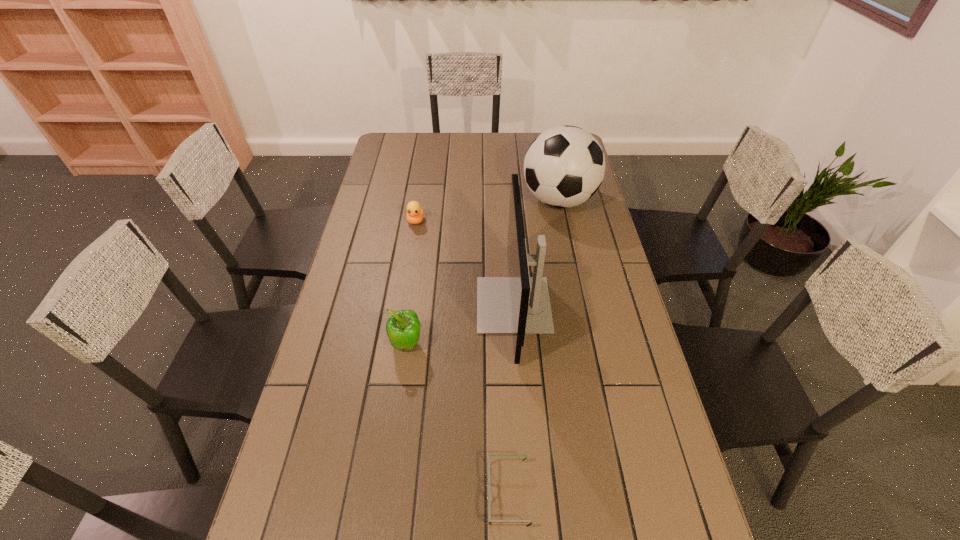
Find the location of a particular element. Image resolution: width=960 pixels, height=540 pixels. object that is the second closest to the nearest object is located at coordinates (403, 329).

Identify the location of vacant space that satisfies the following two spatial constraints: 1. on the screen of the computer monitor; 2. on the front side of the third tallest object. (516, 345).

Find the location of a particular element. vacant space that satisfies the following two spatial constraints: 1. on the face of the bell pepper; 2. on the right side of the fourth tallest object is located at coordinates (396, 345).

This screenshot has height=540, width=960. I want to click on free space that satisfies the following two spatial constraints: 1. on the face of the second shortest object; 2. on the left side of the bell pepper, so click(x=396, y=345).

You are a GUI agent. You are given a task and a screenshot of the screen. Output one action in this format:
    pyautogui.click(x=<x>, y=<y>)
    Task: Click on the free space that satisfies the following two spatial constraints: 1. on the face of the third shortest object; 2. on the left side of the duckling
    
    Given the screenshot: What is the action you would take?
    pyautogui.click(x=396, y=345)